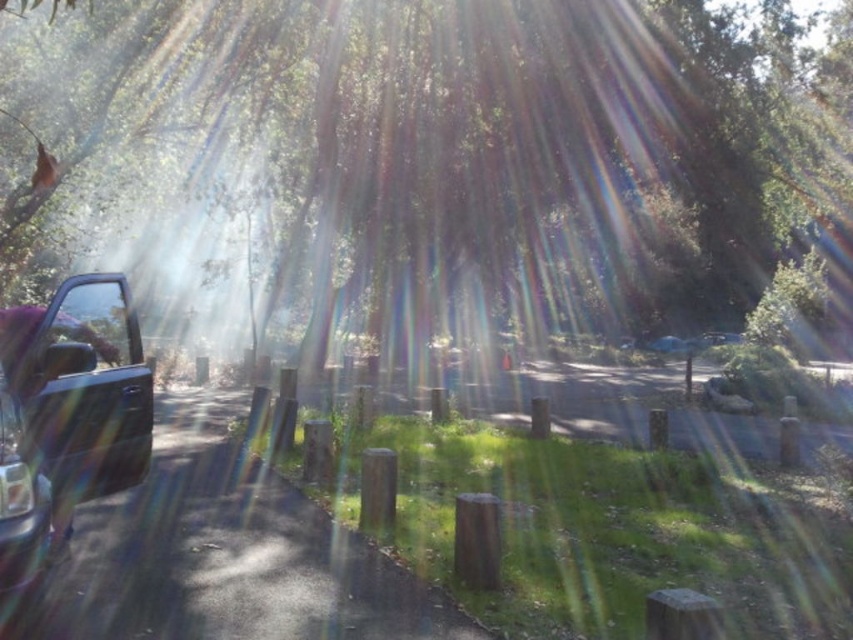
Question: Which point is farther from the camera taking this photo?

Choices:
 (A) (38, 566)
 (B) (814, 196)
 (C) (106, 348)

Answer: (B)

Question: Can you confirm if green leafy tree at left is smaller than shiny metallic truck at left?

Choices:
 (A) yes
 (B) no

Answer: (B)

Question: Estimate the real-world distances between objects in this image. Which object is farther from the green leafy tree at left?

Choices:
 (A) shiny metallic truck at left
 (B) clear glass window at left

Answer: (B)

Question: Does shiny metallic truck at left have a greater width compared to clear glass window at left?

Choices:
 (A) yes
 (B) no

Answer: (A)

Question: Does green leafy tree at left have a greater width compared to clear glass window at left?

Choices:
 (A) yes
 (B) no

Answer: (A)

Question: Which point is farther to the camera?

Choices:
 (A) clear glass window at left
 (B) green leafy tree at left

Answer: (B)